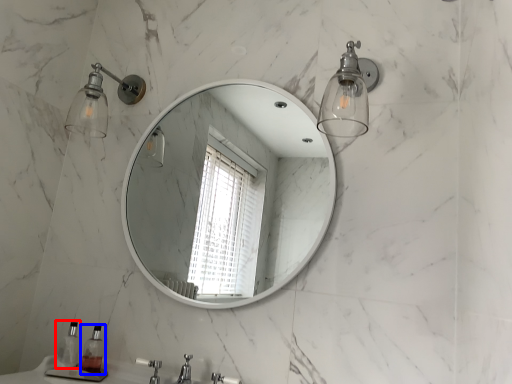
Question: Among these objects, which one is farthest to the camera, soap dispenser (highlighted by a red box) or soap dispenser (highlighted by a blue box)?

Choices:
 (A) soap dispenser
 (B) soap dispenser

Answer: (A)